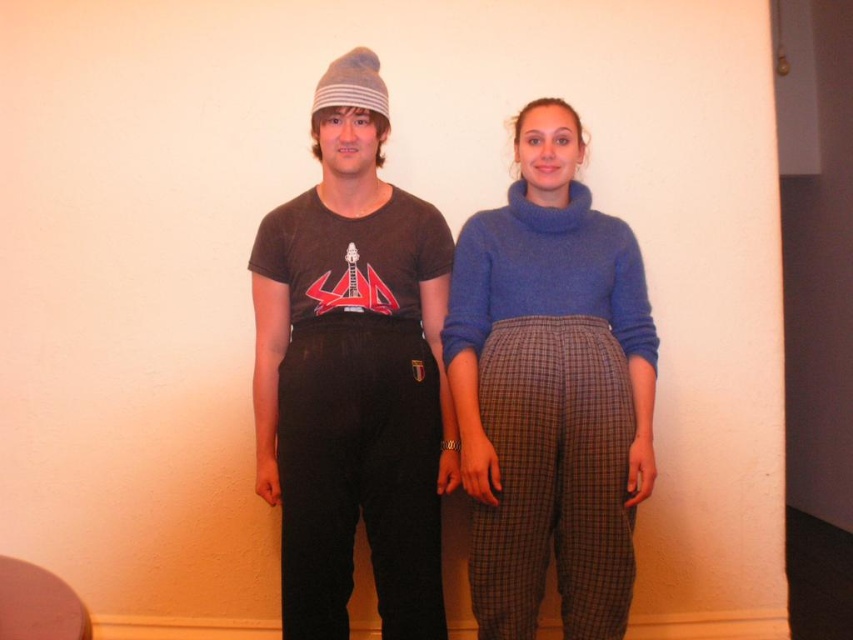
You are a photographer setting up for a photoshoot. You need to position the blue woolen sweater at center and the striped knit beanie at center in a way that the beanie is to the left of the sweater. Are the current positions of these items in the image suitable for your requirement?

The blue woolen sweater at center is positioned on the right side of the striped knit beanie at center, so the current positions already meet your requirement as the beanie is to the left of the sweater.

You are organizing a photo shoot and need to arrange two props. The matte black pants at center and the striped knit beanie at center must be placed on a shelf. According to the image, which prop should be placed to the left of the other?

The matte black pants at center should be placed to the left of the striped knit beanie at center because in the image, the matte black pants at center is positioned on the left side of striped knit beanie at center.

You are a fashion designer observing two items in the image. You need to determine if the blue woolen sweater at center can be worn over the plaid wool pants at center. Based on their positions in the image, can the sweater be worn over the pants?

The blue woolen sweater at center is positioned over plaid wool pants at center in the image, so yes, the sweater can be worn over the plaid wool pants at center as they are already layered that way.